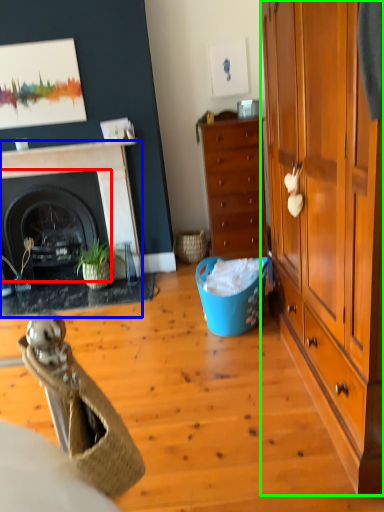
Question: Estimate the real-world distances between objects in this image. Which object is farther from fireplace (highlighted by a red box), fireplace (highlighted by a blue box) or cabinetry (highlighted by a green box)?

Choices:
 (A) fireplace
 (B) cabinetry

Answer: (B)